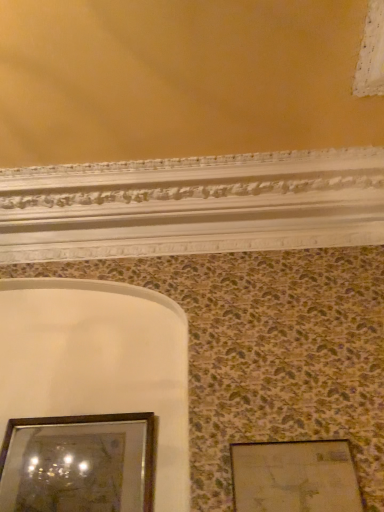
What do you see at coordinates (78, 464) in the screenshot? I see `wooden framed mirror at lower left, arranged as the first picture frame when viewed from the left` at bounding box center [78, 464].

This screenshot has height=512, width=384. Find the location of `wooden framed mirror at lower left, marked as the 2th picture frame in a right-to-left arrangement`. wooden framed mirror at lower left, marked as the 2th picture frame in a right-to-left arrangement is located at coordinates (78, 464).

Locate an element on the screen. wooden picture frame at lower right, arranged as the second picture frame when viewed from the left is located at coordinates (294, 477).

The image size is (384, 512). Describe the element at coordinates (294, 477) in the screenshot. I see `wooden picture frame at lower right, the 1th picture frame positioned from the right` at that location.

You are a GUI agent. You are given a task and a screenshot of the screen. Output one action in this format:
    pyautogui.click(x=<x>, y=<y>)
    Task: Click on the wooden framed mirror at lower left, arranged as the first picture frame when viewed from the left
    Image resolution: width=384 pixels, height=512 pixels.
    Given the screenshot: What is the action you would take?
    pyautogui.click(x=78, y=464)

Which is more to the right, wooden framed mirror at lower left, marked as the 2th picture frame in a right-to-left arrangement, or wooden picture frame at lower right, the 1th picture frame positioned from the right?

wooden picture frame at lower right, the 1th picture frame positioned from the right.

Is wooden framed mirror at lower left, arranged as the first picture frame when viewed from the left, further to the viewer compared to wooden picture frame at lower right, the 1th picture frame positioned from the right?

Yes, wooden framed mirror at lower left, arranged as the first picture frame when viewed from the left, is further from the viewer.

Which point is more distant from viewer, (x=110, y=481) or (x=258, y=444)?

The point (x=110, y=481) is farther from the camera.

From the image's perspective, between wooden framed mirror at lower left, marked as the 2th picture frame in a right-to-left arrangement, and wooden picture frame at lower right, the 1th picture frame positioned from the right, who is located below?

wooden framed mirror at lower left, marked as the 2th picture frame in a right-to-left arrangement, is shown below in the image.

From a real-world perspective, is wooden framed mirror at lower left, arranged as the first picture frame when viewed from the left, physically located above or below wooden picture frame at lower right, arranged as the second picture frame when viewed from the left?

wooden framed mirror at lower left, arranged as the first picture frame when viewed from the left, is above wooden picture frame at lower right, arranged as the second picture frame when viewed from the left.

Can you confirm if wooden framed mirror at lower left, marked as the 2th picture frame in a right-to-left arrangement, is wider than wooden picture frame at lower right, the 1th picture frame positioned from the right?

Indeed, wooden framed mirror at lower left, marked as the 2th picture frame in a right-to-left arrangement, has a greater width compared to wooden picture frame at lower right, the 1th picture frame positioned from the right.

In terms of height, does wooden framed mirror at lower left, marked as the 2th picture frame in a right-to-left arrangement, look taller or shorter compared to wooden picture frame at lower right, arranged as the second picture frame when viewed from the left?

wooden framed mirror at lower left, marked as the 2th picture frame in a right-to-left arrangement, is taller than wooden picture frame at lower right, arranged as the second picture frame when viewed from the left.

Based on their sizes in the image, would you say wooden framed mirror at lower left, arranged as the first picture frame when viewed from the left, is bigger or smaller than wooden picture frame at lower right, the 1th picture frame positioned from the right?

In the image, wooden framed mirror at lower left, arranged as the first picture frame when viewed from the left, appears to be larger than wooden picture frame at lower right, the 1th picture frame positioned from the right.

Is wooden framed mirror at lower left, marked as the 2th picture frame in a right-to-left arrangement, not inside wooden picture frame at lower right, the 1th picture frame positioned from the right?

Yes, wooden framed mirror at lower left, marked as the 2th picture frame in a right-to-left arrangement, is located beyond the bounds of wooden picture frame at lower right, the 1th picture frame positioned from the right.

Can you see wooden framed mirror at lower left, arranged as the first picture frame when viewed from the left, touching wooden picture frame at lower right, the 1th picture frame positioned from the right?

They are not placed beside each other.

Is wooden framed mirror at lower left, arranged as the first picture frame when viewed from the left, oriented towards wooden picture frame at lower right, arranged as the second picture frame when viewed from the left?

No.

How different are the orientations of wooden framed mirror at lower left, marked as the 2th picture frame in a right-to-left arrangement, and wooden picture frame at lower right, arranged as the second picture frame when viewed from the left, in degrees?

The angular difference between wooden framed mirror at lower left, marked as the 2th picture frame in a right-to-left arrangement, and wooden picture frame at lower right, arranged as the second picture frame when viewed from the left, is 0.276 degrees.

How distant is wooden framed mirror at lower left, marked as the 2th picture frame in a right-to-left arrangement, from wooden picture frame at lower right, arranged as the second picture frame when viewed from the left?

wooden framed mirror at lower left, marked as the 2th picture frame in a right-to-left arrangement, is 29.88 inches from wooden picture frame at lower right, arranged as the second picture frame when viewed from the left.

Find the location of a particular element. This screenshot has height=512, width=384. picture frame below the wooden framed mirror at lower left, marked as the 2th picture frame in a right-to-left arrangement (from a real-world perspective) is located at coordinates click(x=294, y=477).

Based on the photo, which is more to the left, wooden picture frame at lower right, arranged as the second picture frame when viewed from the left, or wooden framed mirror at lower left, marked as the 2th picture frame in a right-to-left arrangement?

wooden framed mirror at lower left, marked as the 2th picture frame in a right-to-left arrangement, is more to the left.

Is the position of wooden picture frame at lower right, the 1th picture frame positioned from the right, more distant than that of wooden framed mirror at lower left, arranged as the first picture frame when viewed from the left?

No.

Which is behind, point (341, 500) or point (41, 430)?

The point (41, 430) is farther from the camera.

From the image's perspective, is wooden picture frame at lower right, the 1th picture frame positioned from the right, beneath wooden framed mirror at lower left, marked as the 2th picture frame in a right-to-left arrangement?

No, from the image's perspective, wooden picture frame at lower right, the 1th picture frame positioned from the right, is not below wooden framed mirror at lower left, marked as the 2th picture frame in a right-to-left arrangement.

From a real-world perspective, relative to wooden framed mirror at lower left, arranged as the first picture frame when viewed from the left, is wooden picture frame at lower right, the 1th picture frame positioned from the right, vertically above or below?

wooden picture frame at lower right, the 1th picture frame positioned from the right, is below wooden framed mirror at lower left, arranged as the first picture frame when viewed from the left.

In terms of width, does wooden picture frame at lower right, the 1th picture frame positioned from the right, look wider or thinner when compared to wooden framed mirror at lower left, arranged as the first picture frame when viewed from the left?

Considering their sizes, wooden picture frame at lower right, the 1th picture frame positioned from the right, looks slimmer than wooden framed mirror at lower left, arranged as the first picture frame when viewed from the left.

Between wooden picture frame at lower right, the 1th picture frame positioned from the right, and wooden framed mirror at lower left, marked as the 2th picture frame in a right-to-left arrangement, which one has more height?

wooden framed mirror at lower left, marked as the 2th picture frame in a right-to-left arrangement, is taller.

Is wooden picture frame at lower right, the 1th picture frame positioned from the right, bigger than wooden framed mirror at lower left, arranged as the first picture frame when viewed from the left?

Incorrect, wooden picture frame at lower right, the 1th picture frame positioned from the right, is not larger than wooden framed mirror at lower left, arranged as the first picture frame when viewed from the left.

Is wooden framed mirror at lower left, arranged as the first picture frame when viewed from the left, located within wooden picture frame at lower right, the 1th picture frame positioned from the right?

No, wooden framed mirror at lower left, arranged as the first picture frame when viewed from the left, is not surrounded by wooden picture frame at lower right, the 1th picture frame positioned from the right.

Is wooden picture frame at lower right, the 1th picture frame positioned from the right, directly adjacent to wooden framed mirror at lower left, arranged as the first picture frame when viewed from the left?

There is a gap between wooden picture frame at lower right, the 1th picture frame positioned from the right, and wooden framed mirror at lower left, arranged as the first picture frame when viewed from the left.

Is wooden picture frame at lower right, arranged as the second picture frame when viewed from the left, turned away from wooden framed mirror at lower left, arranged as the first picture frame when viewed from the left?

No, wooden picture frame at lower right, arranged as the second picture frame when viewed from the left, is not facing away from wooden framed mirror at lower left, arranged as the first picture frame when viewed from the left.

Can you tell me how much wooden picture frame at lower right, the 1th picture frame positioned from the right, and wooden framed mirror at lower left, arranged as the first picture frame when viewed from the left, differ in facing direction?

The angular difference between wooden picture frame at lower right, the 1th picture frame positioned from the right, and wooden framed mirror at lower left, arranged as the first picture frame when viewed from the left, is 0.276 degrees.

Could you measure the distance between wooden picture frame at lower right, arranged as the second picture frame when viewed from the left, and wooden framed mirror at lower left, arranged as the first picture frame when viewed from the left?

A distance of 29.88 inches exists between wooden picture frame at lower right, arranged as the second picture frame when viewed from the left, and wooden framed mirror at lower left, arranged as the first picture frame when viewed from the left.

You are a GUI agent. You are given a task and a screenshot of the screen. Output one action in this format:
    pyautogui.click(x=<x>, y=<y>)
    Task: Click on the picture frame that is under the wooden framed mirror at lower left, arranged as the first picture frame when viewed from the left (from a real-world perspective)
    The width and height of the screenshot is (384, 512).
    Given the screenshot: What is the action you would take?
    pyautogui.click(x=294, y=477)

The image size is (384, 512). In order to click on picture frame above the wooden picture frame at lower right, the 1th picture frame positioned from the right (from a real-world perspective) in this screenshot , I will do `click(78, 464)`.

The height and width of the screenshot is (512, 384). What are the coordinates of `picture frame that is above the wooden framed mirror at lower left, arranged as the first picture frame when viewed from the left (from the image's perspective)` in the screenshot? It's located at (294, 477).